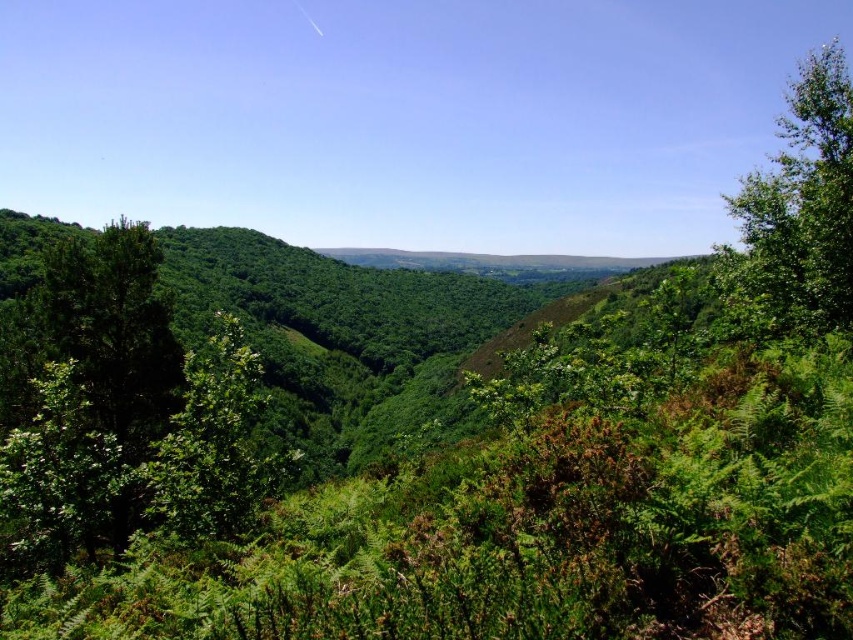
Describe the element at coordinates (799, 209) in the screenshot. I see `green leafy tree at right` at that location.

Between green leafy tree at right and green leafy tree at center, which one has more height?

Standing taller between the two is green leafy tree at right.

You are a GUI agent. You are given a task and a screenshot of the screen. Output one action in this format:
    pyautogui.click(x=<x>, y=<y>)
    Task: Click on the green leafy tree at right
    
    Given the screenshot: What is the action you would take?
    pyautogui.click(x=799, y=209)

Find the location of `green leafy tree at right`. green leafy tree at right is located at coordinates (799, 209).